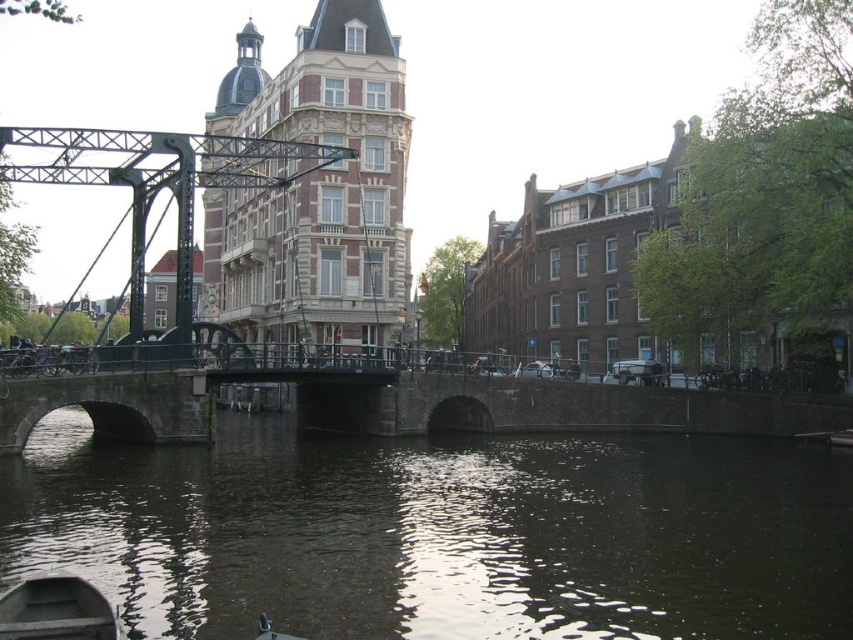
You are a tourist standing on the bank of the canal and want to take a photo of the matte black bridge at center and the wooden boat at lower left. Which object should you frame first in your camera to ensure both are in the shot?

The matte black bridge at center is to the left of the wooden boat at lower left, so you should frame the matte black bridge at center first since it is positioned further left and closer to your vantage point on the bank.

You are standing on the metal bridge with a black framework and looking down at the waterway. You see the dark green water at center and the wooden boat at lower left. Which object is positioned to the right of the other?

The dark green water at center is to the right of the wooden boat at lower left.

You are a tour guide explaining the canal layout to visitors. You mention the dark green water at center and the matte black bridge at center. Which of these two has a greater width in the image?

The dark green water at center has a greater width than the matte black bridge at center, as stated in the description.